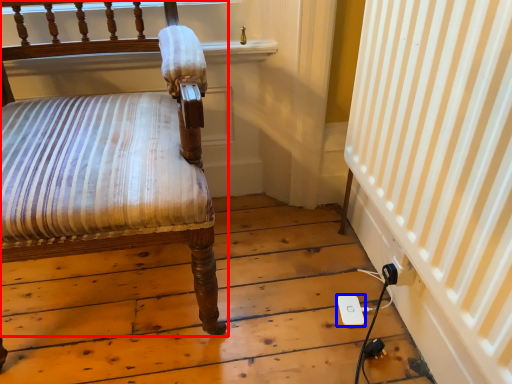
Question: Among these objects, which one is nearest to the camera, chair (highlighted by a red box) or ipod (highlighted by a blue box)?

Choices:
 (A) chair
 (B) ipod

Answer: (A)